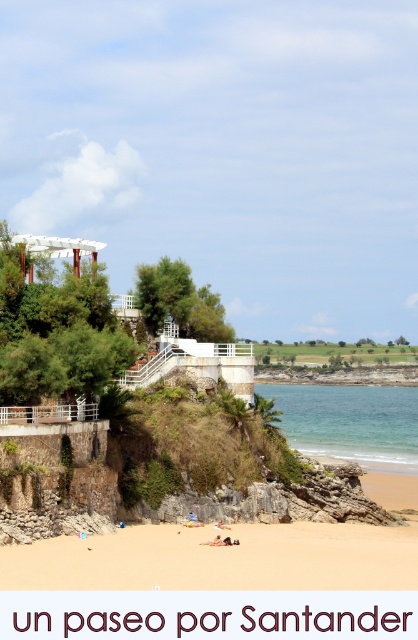
Who is more forward, (127, 531) or (282, 403)?

Point (127, 531) is more forward.

Is golden sandy beach at lower center wider than clear blue water at lower center?

No, golden sandy beach at lower center is not wider than clear blue water at lower center.

Is point (241, 580) positioned after point (356, 426)?

No, it is in front of (356, 426).

Find the location of a particular element. The width and height of the screenshot is (418, 640). golden sandy beach at lower center is located at coordinates (219, 560).